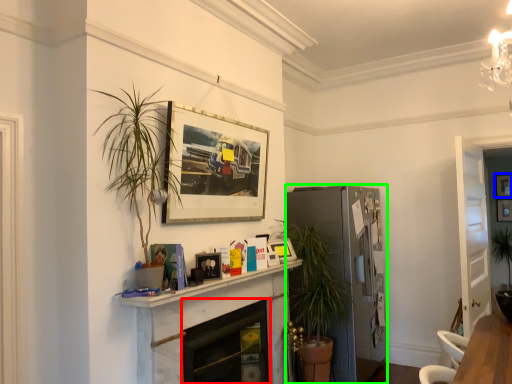
Question: Considering the real-world distances, which object is farthest from fireplace (highlighted by a red box)? picture frame (highlighted by a blue box) or fridge (highlighted by a green box)?

Choices:
 (A) picture frame
 (B) fridge

Answer: (A)